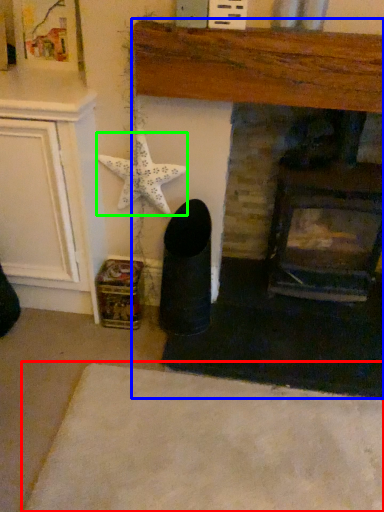
Question: Estimate the real-world distances between objects in this image. Which object is closer to plain (highlighted by a red box), fireplace (highlighted by a blue box) or starfish (highlighted by a green box)?

Choices:
 (A) fireplace
 (B) starfish

Answer: (A)